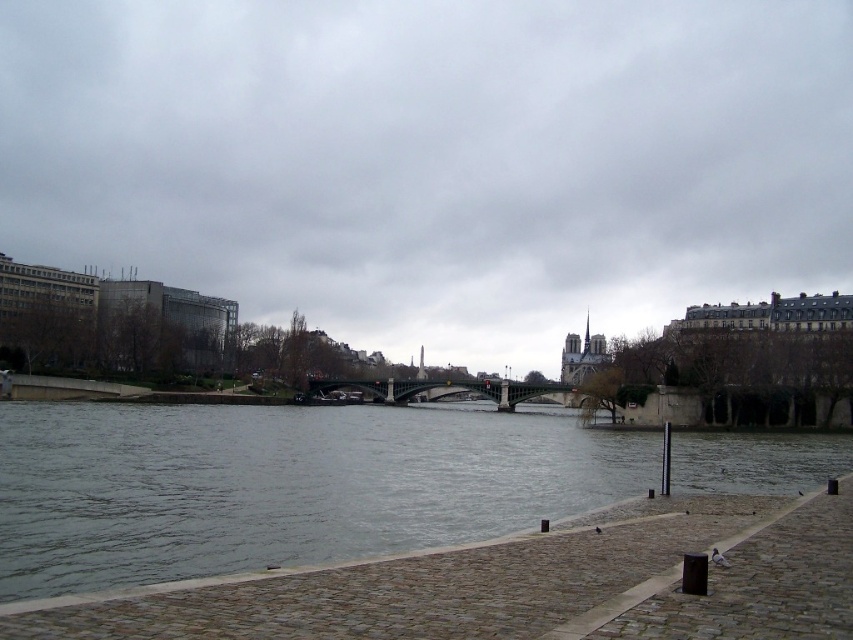
You are standing on the riverside walkway and want to take a photo of both the gray water at center and the green metallic bridge at center. Which object will appear larger in your camera viewfinder?

The gray water at center will appear larger in the camera viewfinder because it is closer to the viewer than the green metallic bridge at center.

You are a drone operator who needs to fly a drone from the cloudy sky at upper center to the green metallic bridge at center. What is the approximate distance you need to cover?

The distance between the cloudy sky at upper center and the green metallic bridge at center is 90.51 meters, so you need to cover approximately 90.51 meters.